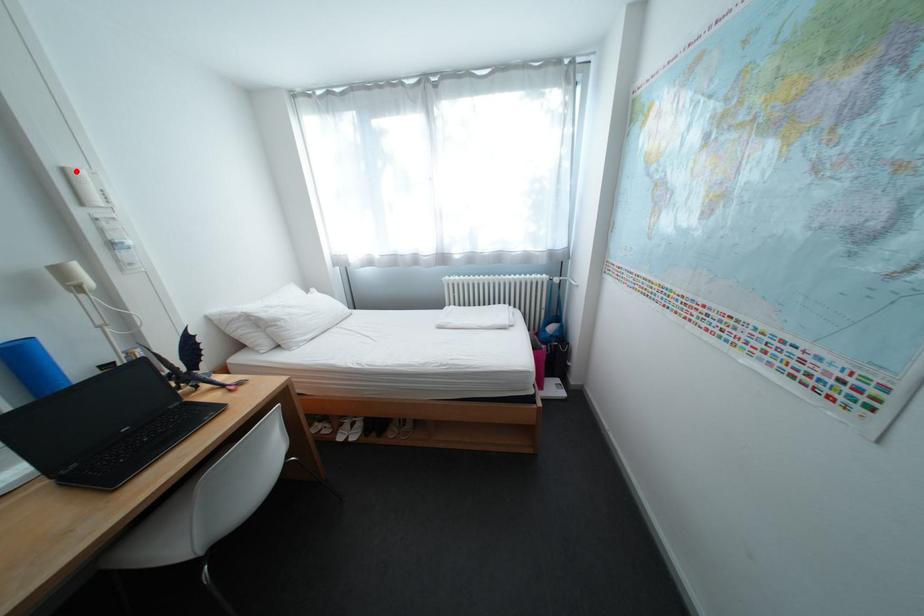
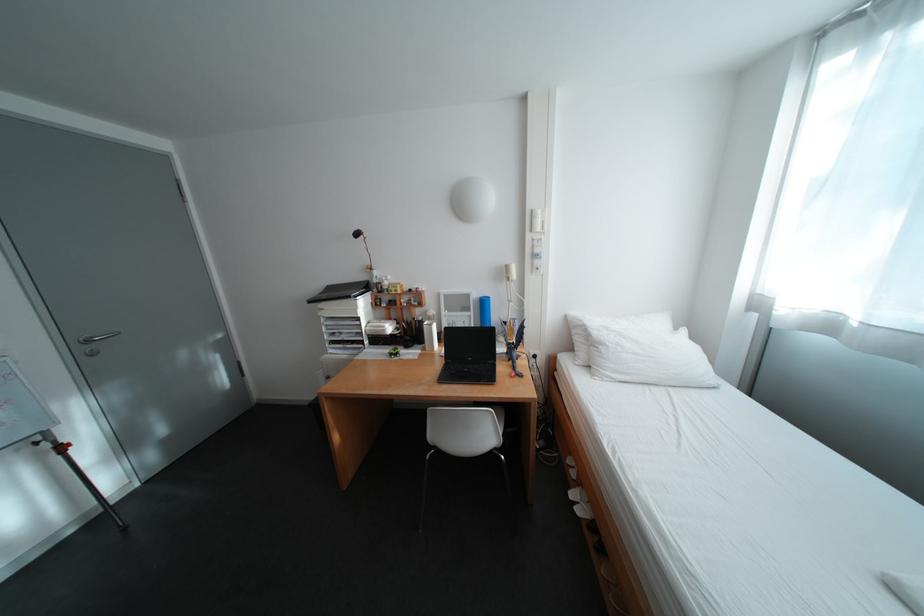
Question: I am providing you with two images of the same scene from different viewpoints. Image1 has a red point marked. In image2, the corresponding 3D location appears at what relative position? Reply with the corresponding letter.

Choices:
 (A) Closer
 (B) Farther

Answer: (A)